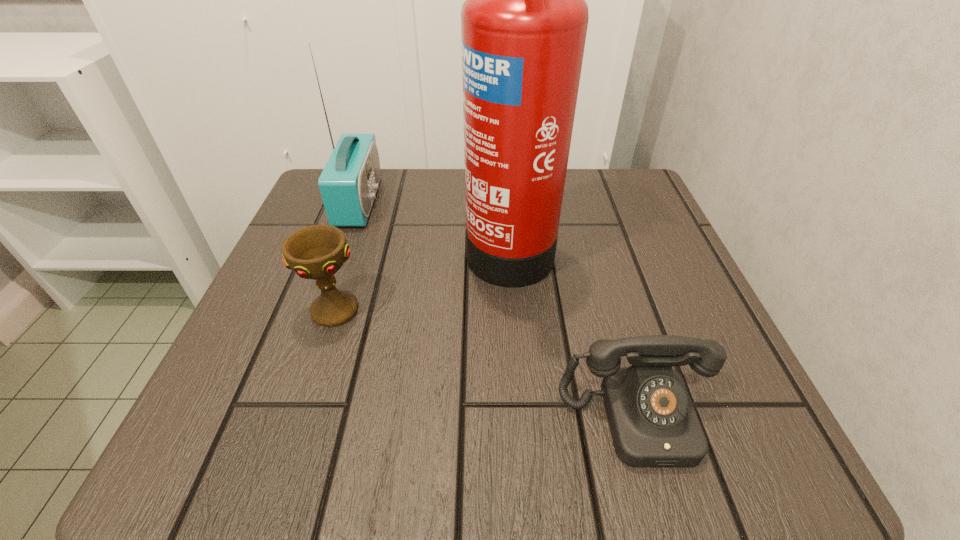
I want to click on vacant space at the left edge of the desktop, so click(245, 376).

In the image, there is a desktop. Where is `vacant space at the right edge`? vacant space at the right edge is located at coordinates (677, 307).

This screenshot has width=960, height=540. I want to click on vacant region at the near left corner of the desktop, so click(x=247, y=428).

In order to click on vacant space at the far right corner in this screenshot , I will do `click(645, 216)`.

Locate an element on the screen. vacant space at the near right corner of the desktop is located at coordinates (719, 408).

Image resolution: width=960 pixels, height=540 pixels. What are the coordinates of `empty space between the tallest object and the chalice` in the screenshot? It's located at (422, 278).

This screenshot has width=960, height=540. I want to click on free space between the radio receiver and the telephone, so click(498, 310).

Find the location of a particular element. The height and width of the screenshot is (540, 960). empty location between the fire extinguisher and the second tallest object is located at coordinates (434, 223).

Identify the location of vacant space that is in between the fire extinguisher and the third shortest object. (434, 223).

At what (x,y) coordinates should I click in order to perform the action: click on free area in between the fire extinguisher and the chalice. Please return your answer as a coordinate pair (x, y). This screenshot has width=960, height=540. Looking at the image, I should click on click(x=422, y=278).